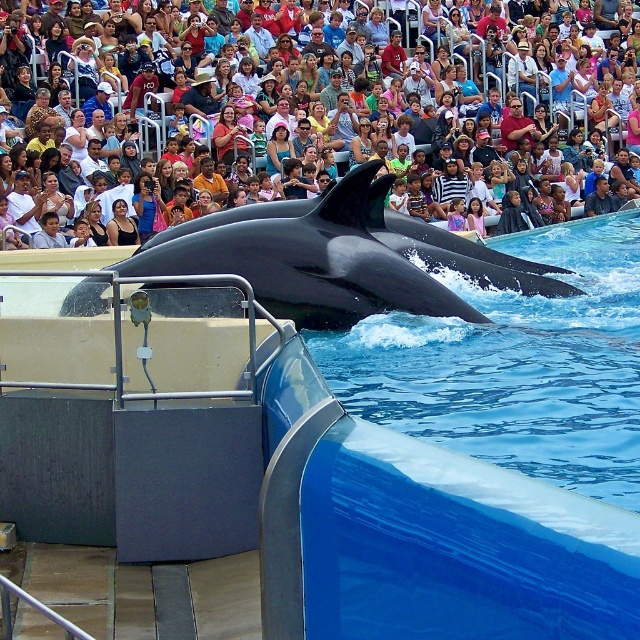
Can you confirm if black smooth whale at center is bigger than matte black dolphin at center?

No, black smooth whale at center is not bigger than matte black dolphin at center.

Can you confirm if black smooth whale at center is positioned above matte black dolphin at center?

Actually, black smooth whale at center is below matte black dolphin at center.

Locate an element on the screen. black smooth whale at center is located at coordinates (339, 257).

This screenshot has height=640, width=640. Identify the location of black smooth whale at center. (339, 257).